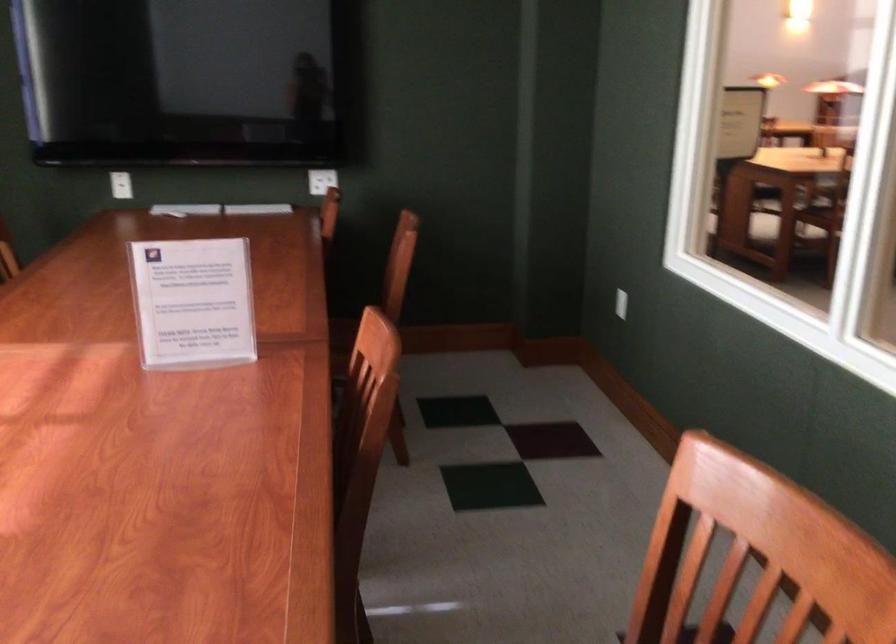
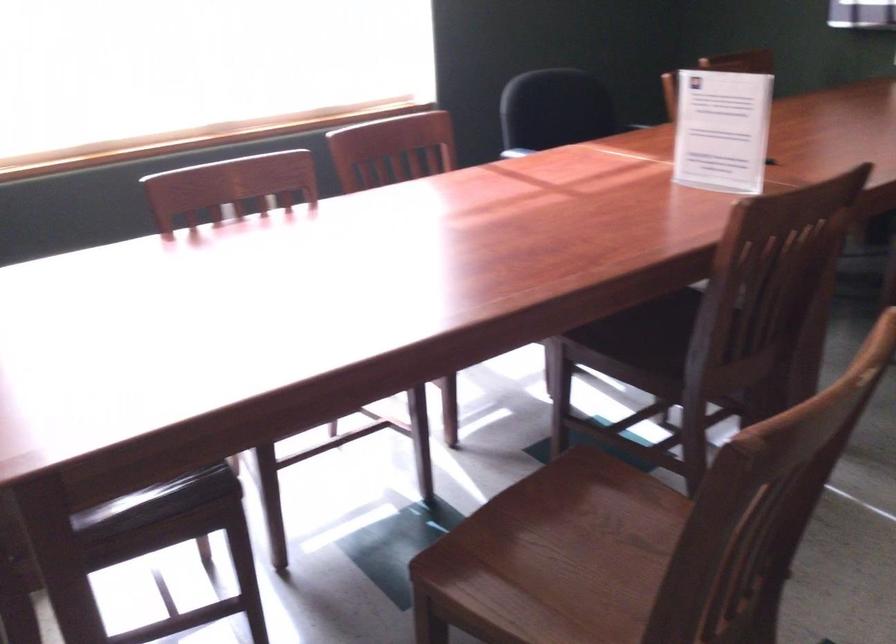
Question: How did the camera likely rotate?

Choices:
 (A) Left
 (B) Right
 (C) Up
 (D) Down

Answer: (A)